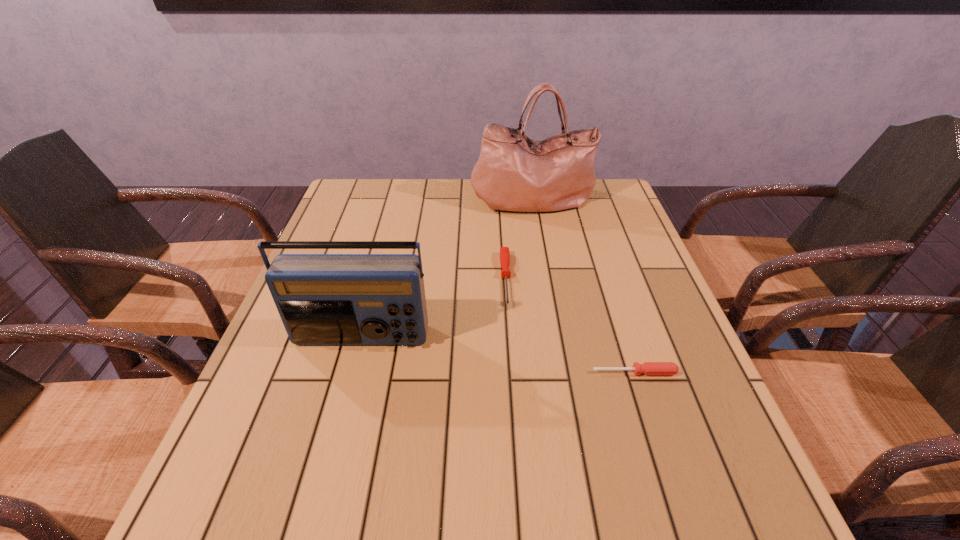
This screenshot has height=540, width=960. Find the location of `vacant region at the right edge of the desktop`. vacant region at the right edge of the desktop is located at coordinates (660, 308).

Identify the location of blank space at the far left corner of the desktop. This screenshot has width=960, height=540. (372, 208).

I want to click on vacant space at the far right corner of the desktop, so click(626, 216).

The width and height of the screenshot is (960, 540). What are the coordinates of `free space that is in between the nearest object and the third nearest object` in the screenshot? It's located at (570, 326).

Identify the location of vacant space in between the right screwdriver and the handbag. This screenshot has width=960, height=540. (584, 286).

Find the location of a particular element. free spot between the second nearest object and the second farthest object is located at coordinates (434, 308).

The width and height of the screenshot is (960, 540). I want to click on free space between the leftmost object and the left screwdriver, so click(x=434, y=308).

Identify the location of blank region between the left screwdriver and the handbag. 519,239.

Locate an element on the screen. Image resolution: width=960 pixels, height=540 pixels. vacant point located between the second nearest object and the farthest object is located at coordinates (447, 269).

This screenshot has width=960, height=540. I want to click on unoccupied area between the leftmost object and the left screwdriver, so click(x=434, y=308).